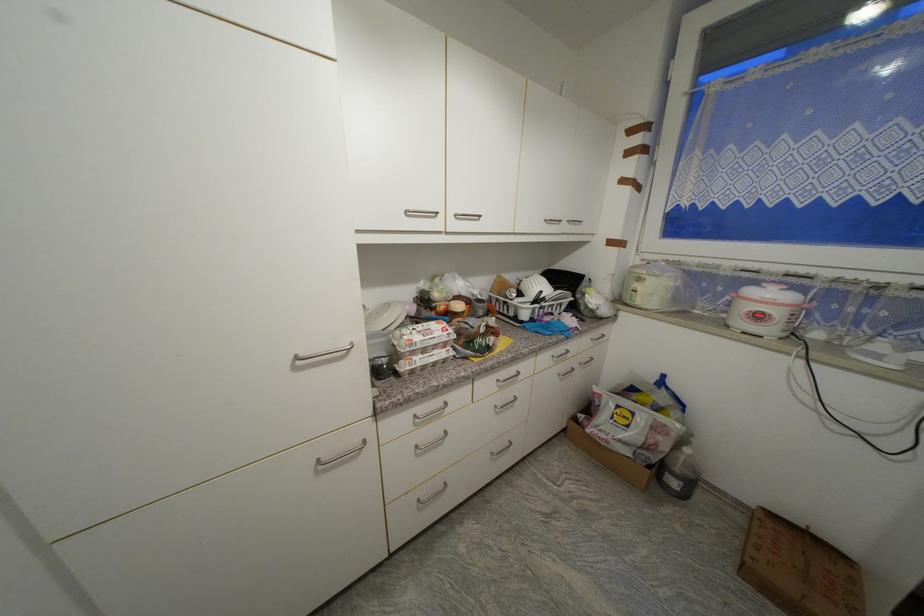
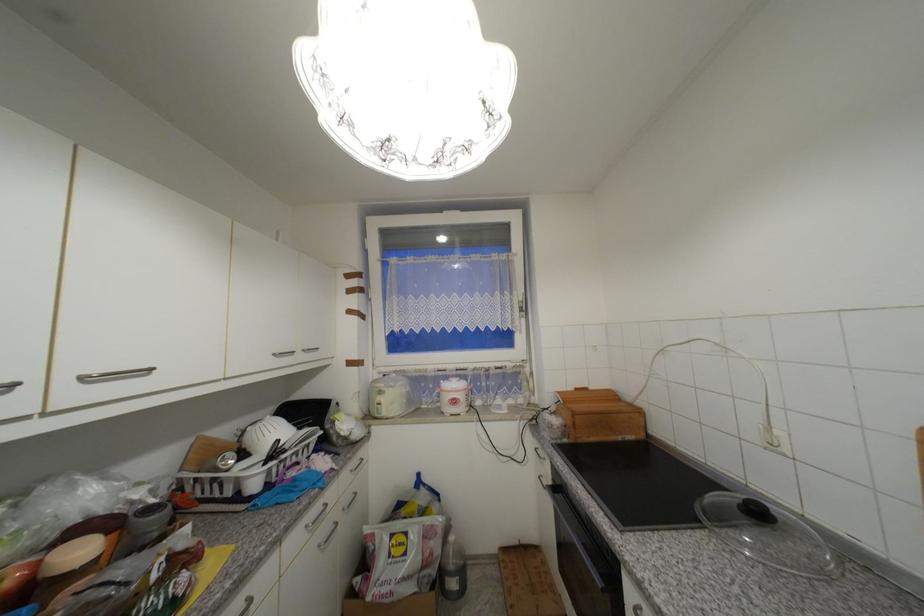
Where in the second image is the point corresponding to (x=599, y=330) from the first image?

(357, 460)